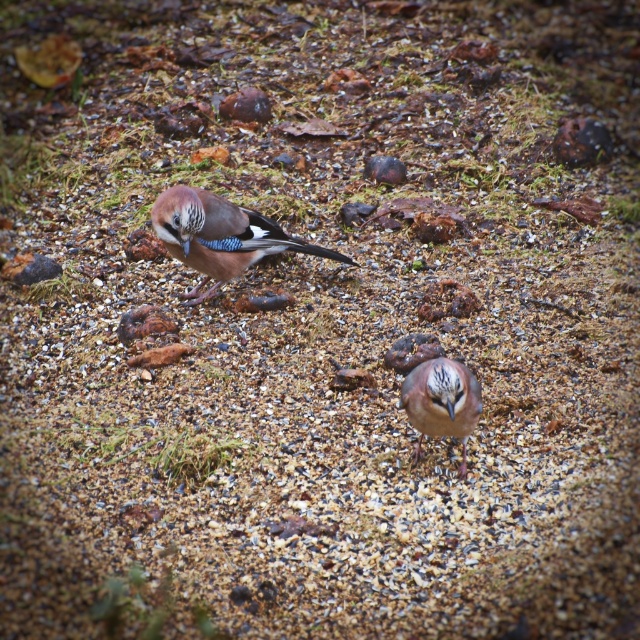
Does matte brown bird at center appear over smooth brown rock at center?

No.

Is matte brown bird at center bigger than smooth brown rock at center?

Yes, matte brown bird at center is bigger than smooth brown rock at center.

Who is more forward, (173,257) or (268,109)?

Positioned in front is point (173,257).

Image resolution: width=640 pixels, height=640 pixels. What are the coordinates of `matte brown bird at center` in the screenshot? It's located at (220, 236).

In the scene shown: Is matte brown bird at center taller than brown speckled feathers at center?

Yes, matte brown bird at center is taller than brown speckled feathers at center.

Is matte brown bird at center wider than brown speckled feathers at center?

Yes, matte brown bird at center is wider than brown speckled feathers at center.

Between point (244, 209) and point (467, 381), which one is positioned in front?

Point (467, 381) is in front.

This screenshot has height=640, width=640. Identify the location of matte brown bird at center. (220, 236).

Does brown speckled feathers at center appear over smooth brown rock at center?

Incorrect, brown speckled feathers at center is not positioned above smooth brown rock at center.

Does brown speckled feathers at center appear on the right side of smooth brown rock at center?

Correct, you'll find brown speckled feathers at center to the right of smooth brown rock at center.

Who is more distant from viewer, [444,420] or [248,88]?

The point [248,88] is more distant.

In order to click on brown speckled feathers at center in this screenshot , I will do `click(442, 403)`.